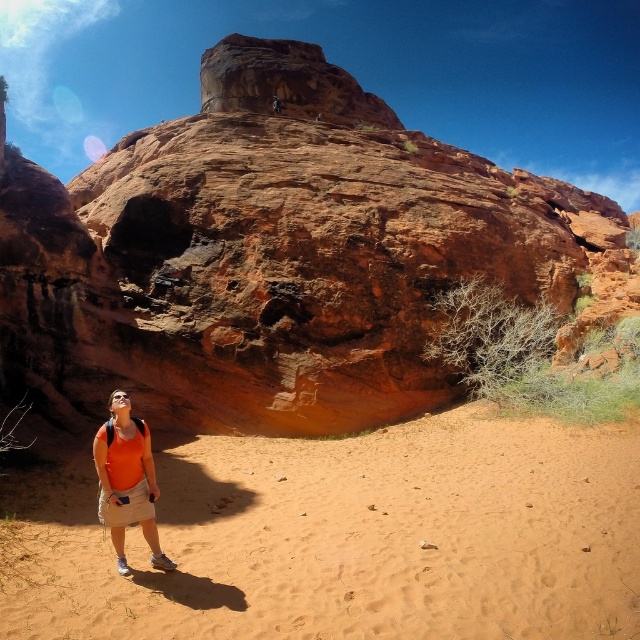
Question: Which object appears farthest from the camera in this image?

Choices:
 (A) orange fabric vest at lower left
 (B) rustic sandstone rock formation at center
 (C) sandy orange sand at lower center
 (D) orange fabric shirt at lower left

Answer: (B)

Question: Is orange fabric shirt at lower left to the left of orange fabric vest at lower left from the viewer's perspective?

Choices:
 (A) no
 (B) yes

Answer: (B)

Question: Does rustic sandstone rock formation at center appear over orange fabric shirt at lower left?

Choices:
 (A) yes
 (B) no

Answer: (A)

Question: Is rustic sandstone rock formation at center positioned at the back of orange fabric shirt at lower left?

Choices:
 (A) yes
 (B) no

Answer: (A)

Question: Which object appears farthest from the camera in this image?

Choices:
 (A) rustic sandstone rock formation at center
 (B) orange fabric shirt at lower left
 (C) sandy orange sand at lower center

Answer: (A)

Question: Among these objects, which one is farthest from the camera?

Choices:
 (A) sandy orange sand at lower center
 (B) orange fabric vest at lower left

Answer: (B)